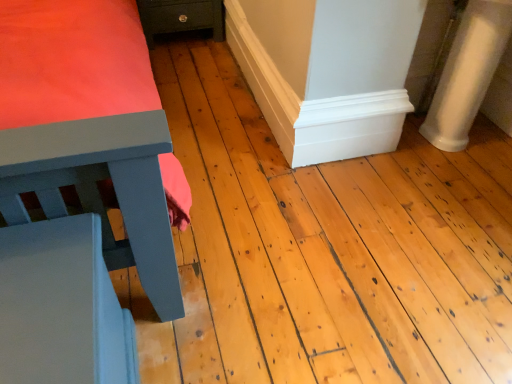
Question: Should I look upward or downward to see white smooth column at right?

Choices:
 (A) down
 (B) up

Answer: (B)